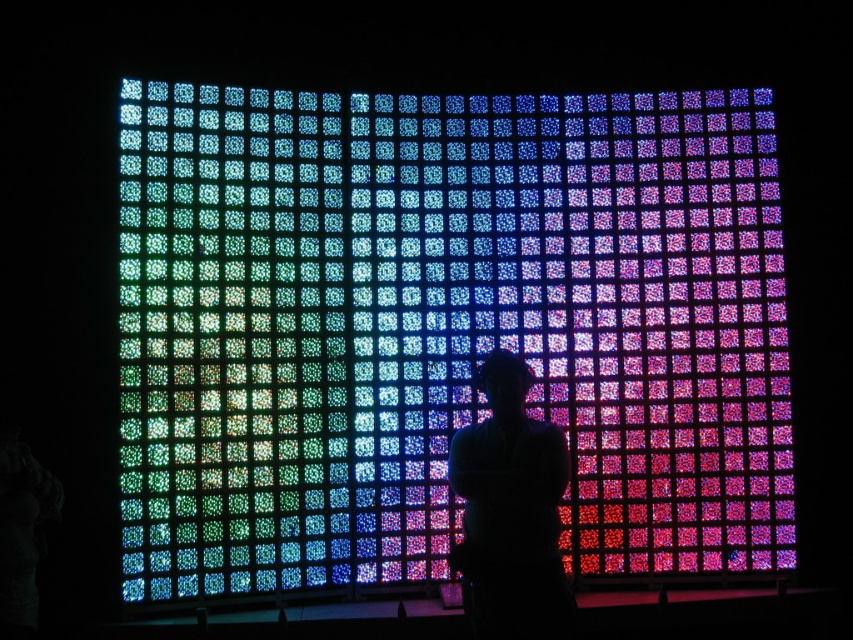
Question: Which point is closer to the camera?

Choices:
 (A) multicolored glass mosaic at center
 (B) silhouette figure at center

Answer: (B)

Question: Does multicolored glass mosaic at center lie behind silhouette figure at center?

Choices:
 (A) yes
 (B) no

Answer: (A)

Question: Can you confirm if multicolored glass mosaic at center is wider than silhouette figure at center?

Choices:
 (A) yes
 (B) no

Answer: (A)

Question: Is multicolored glass mosaic at center positioned behind silhouette figure at center?

Choices:
 (A) no
 (B) yes

Answer: (B)